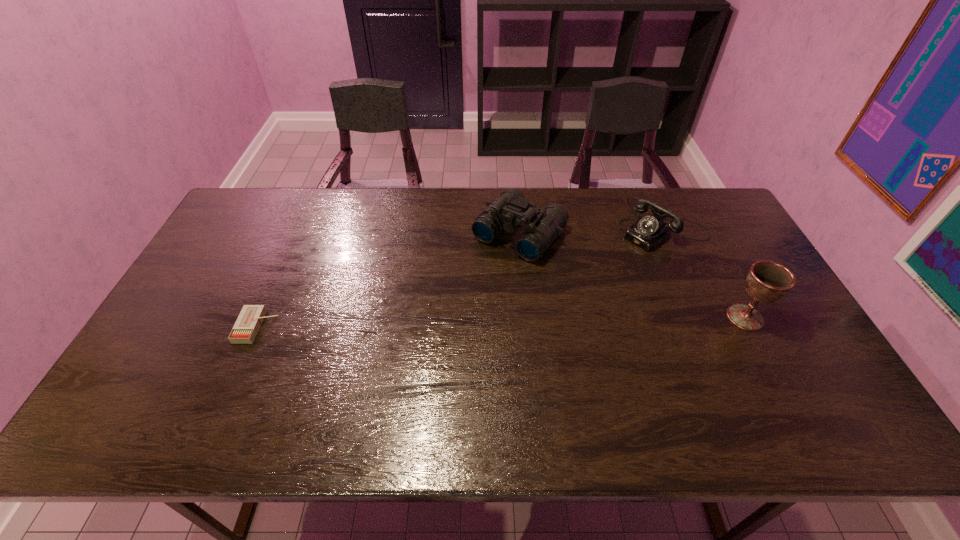
Locate an element on the screen. The image size is (960, 540). vacant space located 0.230m on the front-facing side of the telephone is located at coordinates (589, 279).

In order to click on vacant region located on the front-facing side of the telephone in this screenshot , I will do `click(563, 299)`.

The width and height of the screenshot is (960, 540). I want to click on vacant space located on the front-facing side of the telephone, so click(563, 299).

The height and width of the screenshot is (540, 960). What are the coordinates of `binoculars that is at the far edge` in the screenshot? It's located at (543, 225).

You are a GUI agent. You are given a task and a screenshot of the screen. Output one action in this format:
    pyautogui.click(x=<x>, y=<y>)
    Task: Click on the telephone that is at the far edge
    The height and width of the screenshot is (540, 960).
    Given the screenshot: What is the action you would take?
    pyautogui.click(x=649, y=232)

This screenshot has height=540, width=960. What are the coordinates of `chalice that is at the right edge` in the screenshot? It's located at (767, 281).

This screenshot has width=960, height=540. What are the coordinates of `telephone that is at the right edge` in the screenshot? It's located at pos(649,232).

What are the coordinates of `object that is at the far right corner` in the screenshot? It's located at [x=649, y=232].

Where is `vacant point at the far edge`? vacant point at the far edge is located at coordinates (410, 193).

Identify the location of vacant area at the near edge of the desktop. The image size is (960, 540). (285, 386).